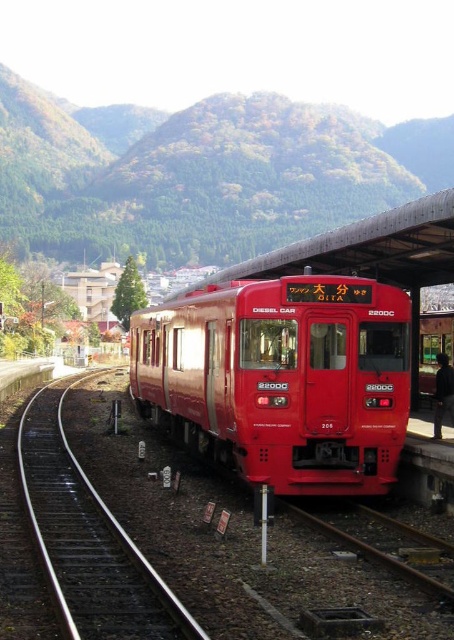
Does shiny red train at center appear over metal/smooth track at lower left?

Indeed, shiny red train at center is positioned over metal/smooth track at lower left.

Does point (319, 349) lie in front of point (138, 632)?

No, it is not.

This screenshot has width=454, height=640. I want to click on shiny red train at center, so click(x=281, y=380).